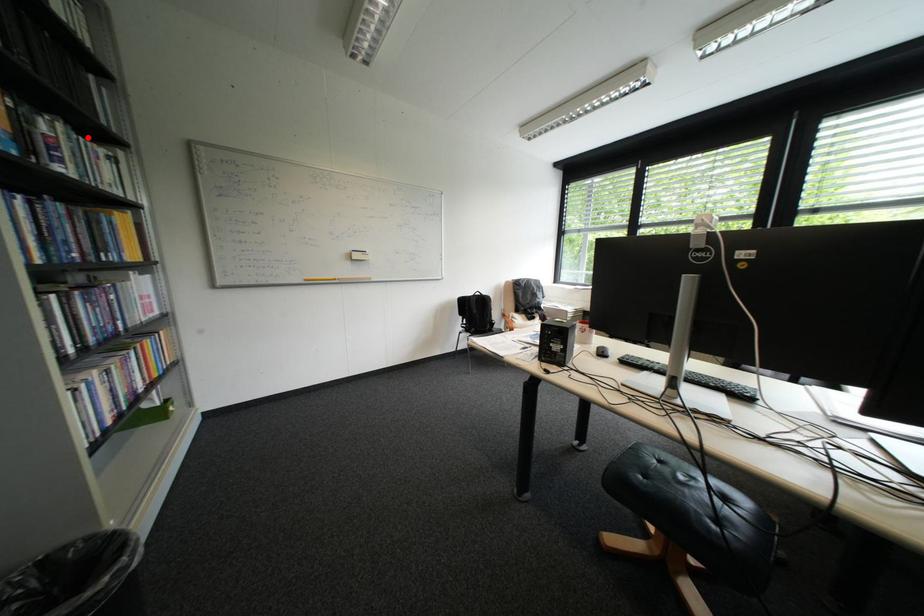
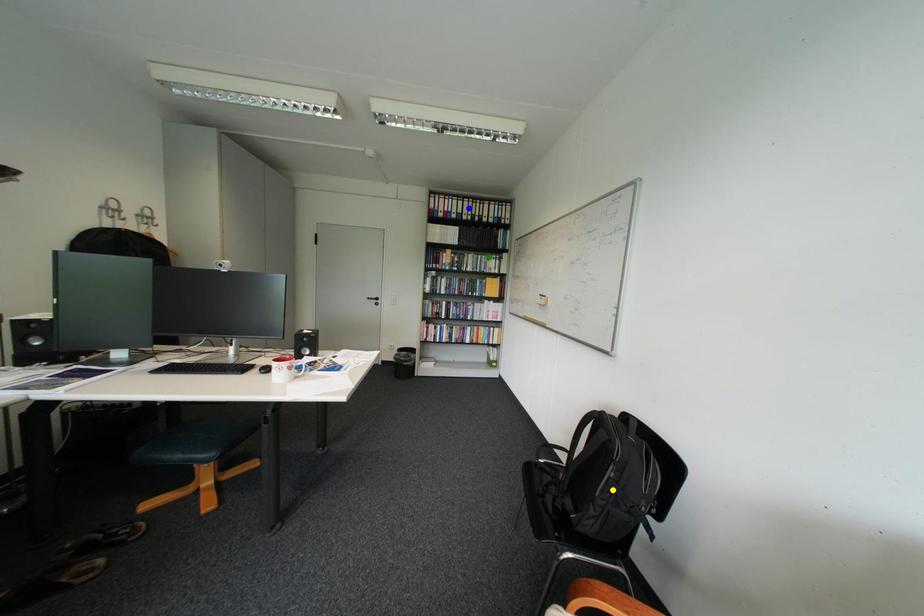
Question: I am providing you with two images of the same scene from different viewpoints. A red point is marked on the first image. You are given multiple points on the second image. Can you choose the point in image 2 that corresponds to the point in image 1?

Choices:
 (A) blue point
 (B) green point
 (C) yellow point

Answer: (B)